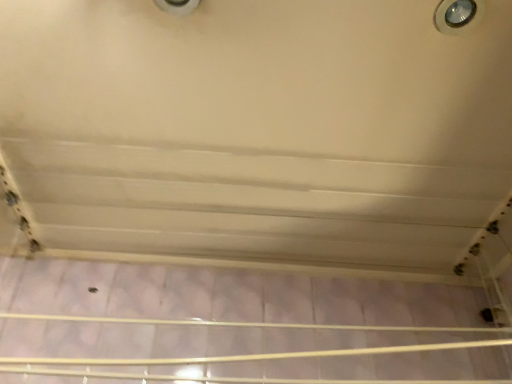
You are a GUI agent. You are given a task and a screenshot of the screen. Output one action in this format:
    pyautogui.click(x=<x>, y=<y>)
    Task: Click on the matte white light fixture at upper right
    This screenshot has height=384, width=512.
    Given the screenshot: What is the action you would take?
    pyautogui.click(x=458, y=15)

Looking at this image, in order to face matte white light fixture at upper right, should I rotate leftwards or rightwards?

Turn right approximately 26.055 degrees to face it.

Describe the element at coordinates (458, 15) in the screenshot. This screenshot has width=512, height=384. I see `matte white light fixture at upper right` at that location.

At what (x,y) coordinates should I click in order to perform the action: click on matte white light fixture at upper right. Please return your answer as a coordinate pair (x, y). This screenshot has width=512, height=384. Looking at the image, I should click on (458, 15).